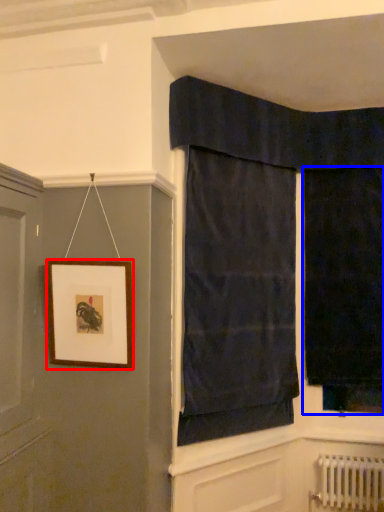
Question: Which of the following is the closest to the observer, picture frame (highlighted by a red box) or curtain (highlighted by a blue box)?

Choices:
 (A) picture frame
 (B) curtain

Answer: (A)